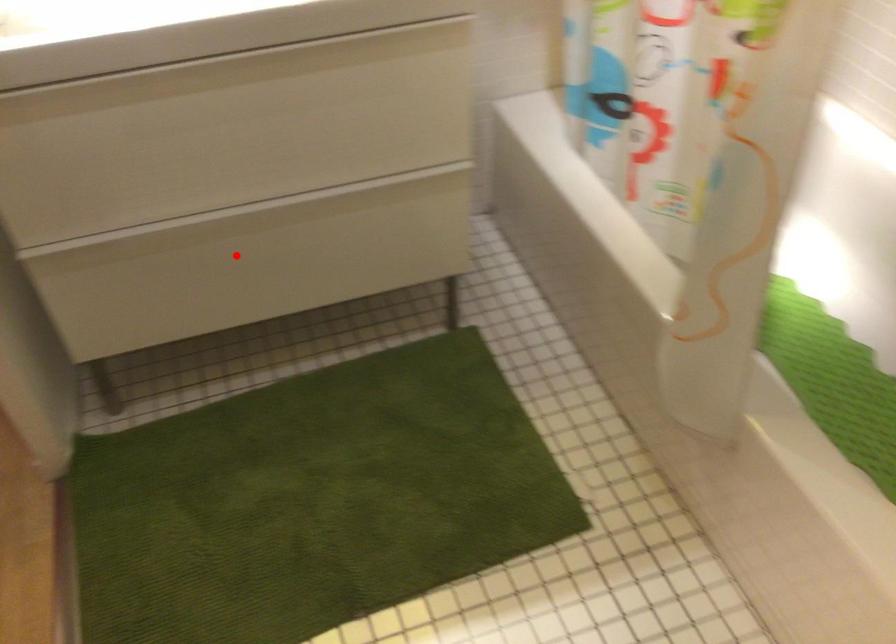
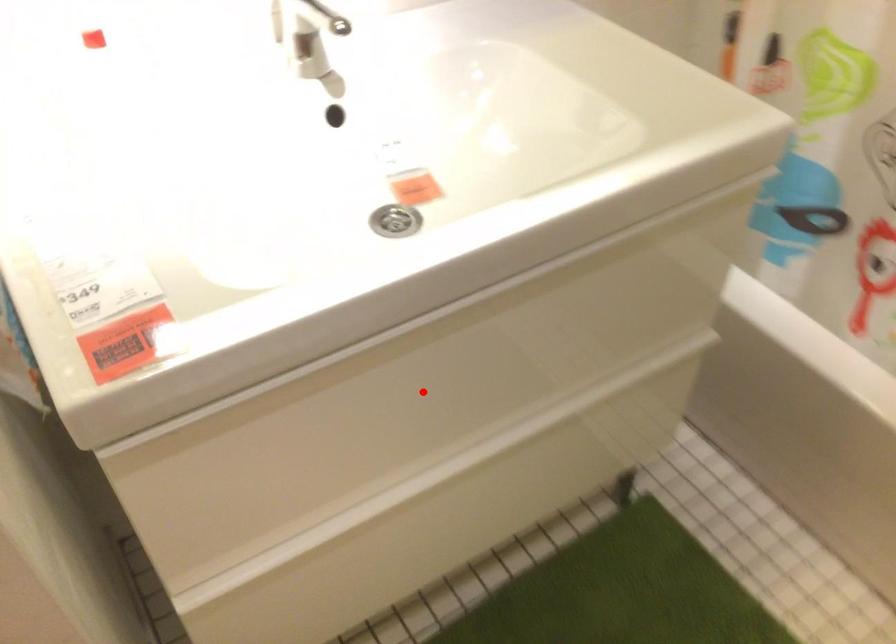
I am providing you with two images of the same scene from different viewpoints. A red point is marked on the first image and another point is marked on the second image. Is the red point in image1 aligned with the point shown in image2?

No